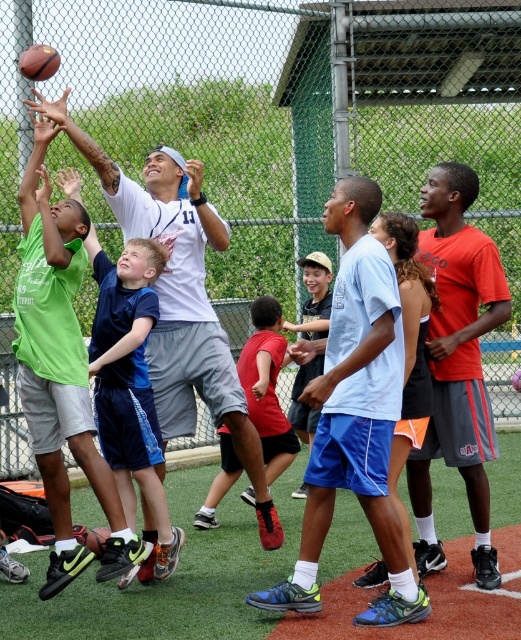
Can you confirm if light blue fabric shirt at center is bigger than red shirt at center?

Indeed, light blue fabric shirt at center has a larger size compared to red shirt at center.

This screenshot has height=640, width=521. Find the location of `light blue fabric shirt at center`. light blue fabric shirt at center is located at coordinates click(353, 413).

Find the location of a particular element. light blue fabric shirt at center is located at coordinates (353, 413).

Between red shirt at center and rubber textured basketball at upper left, which one has less height?

rubber textured basketball at upper left

Between point (307, 285) and point (24, 76), which one is positioned behind?

Point (307, 285)

What do you see at coordinates (315, 296) in the screenshot? I see `red shirt at center` at bounding box center [315, 296].

Identify the location of red shirt at center. The height and width of the screenshot is (640, 521). (315, 296).

Does blue fabric shirt at center lie behind rubber textured basketball at center?

No, it is not.

Find the location of `blue fabric shirt at center`. blue fabric shirt at center is located at coordinates (130, 381).